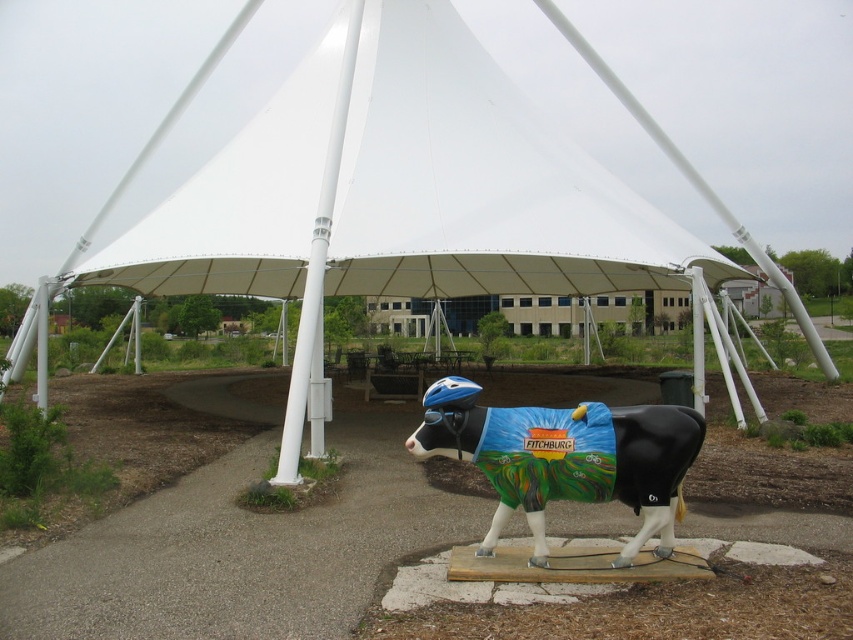
Which is below, white fabric tent at center or painted fiberglass cow at center?

painted fiberglass cow at center is below.

Is white fabric tent at center above painted fiberglass cow at center?

Indeed, white fabric tent at center is positioned over painted fiberglass cow at center.

This screenshot has height=640, width=853. Describe the element at coordinates (397, 195) in the screenshot. I see `white fabric tent at center` at that location.

Identify the location of white fabric tent at center. The image size is (853, 640). (397, 195).